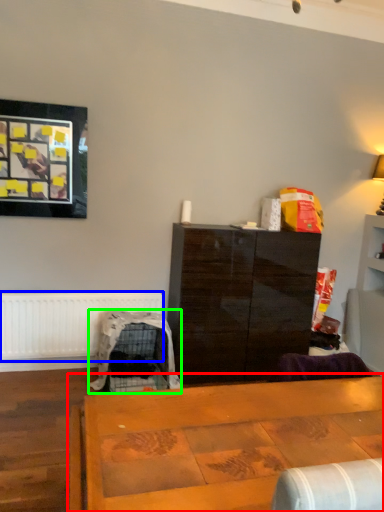
Question: Based on their relative distances, which object is farther from table (highlighted by a red box)? Choose from radiator (highlighted by a blue box) and swivel chair (highlighted by a green box).

Choices:
 (A) radiator
 (B) swivel chair

Answer: (A)